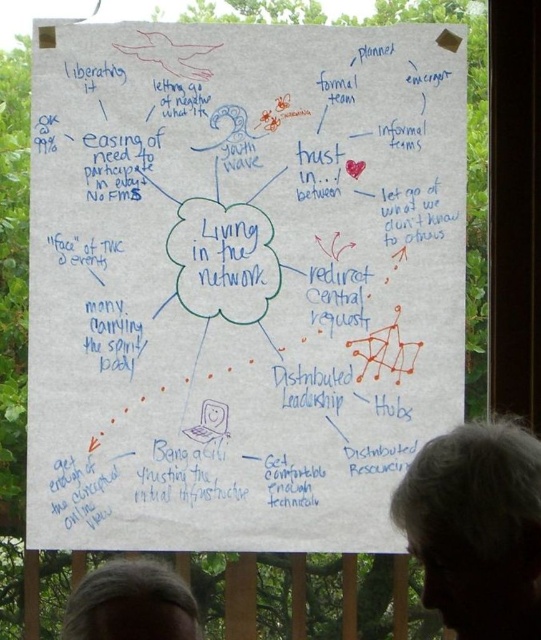
Looking at this image, you are standing in front of the whiteboard and need to reach the white paper at center to write a note. If your arm can extend 0.8 meters, can you reach it?

The white paper at center is 3.10 meters away from the camera, so your arm can only extend 0.8 meters. You cannot reach it without moving closer.

You are an artist standing in front of the white paper at center and the gray hair at lower right. You want to hang a small picture frame exactly between them. Can you tell me which object you should place the frame closer to?

Result: The white paper at center is much taller than gray hair at lower right, so you should place the frame closer to the gray hair at lower right to maintain balance between the two objects.